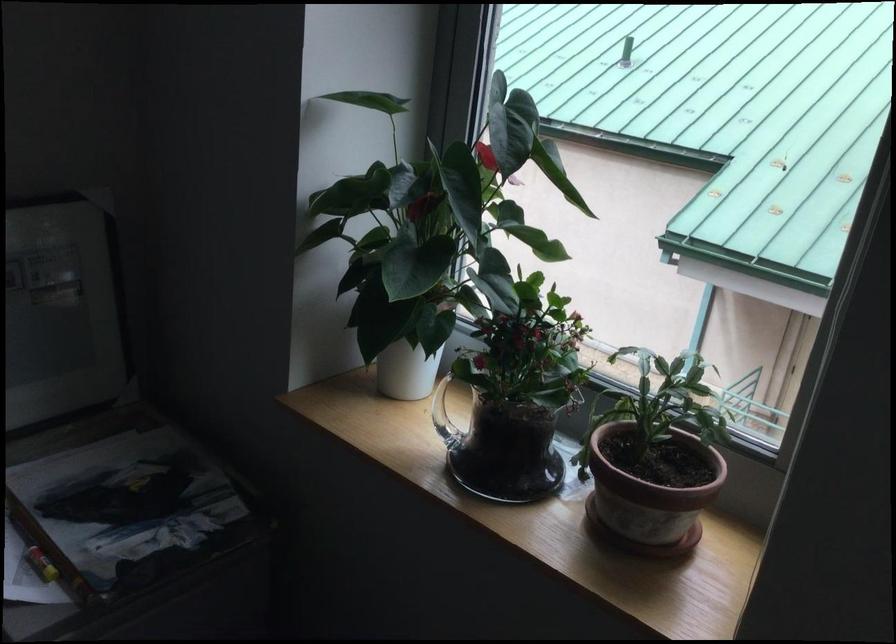
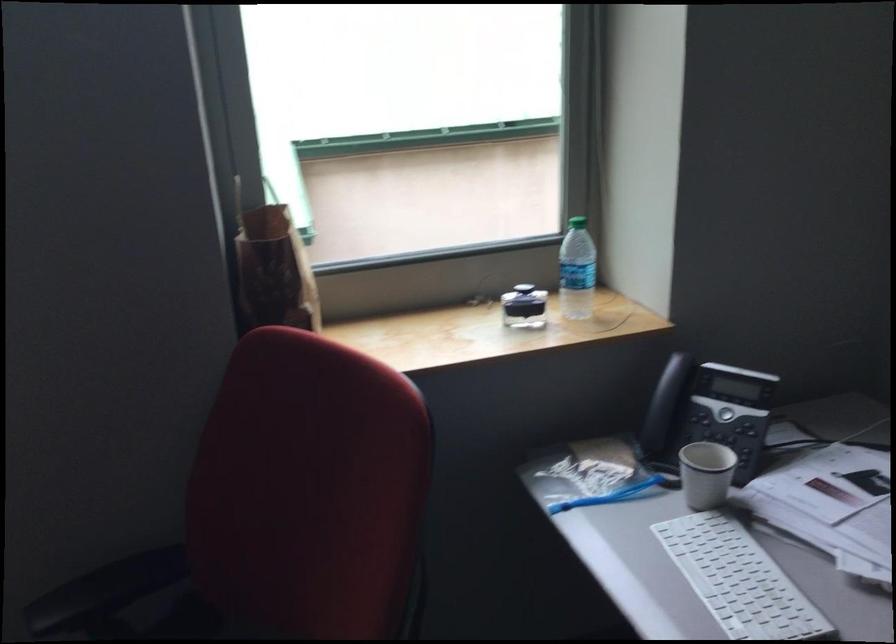
Question: The images are taken continuously from a first-person perspective. In which direction is your viewpoint rotating?

Choices:
 (A) Left
 (B) Right
 (C) Up
 (D) Down

Answer: (B)